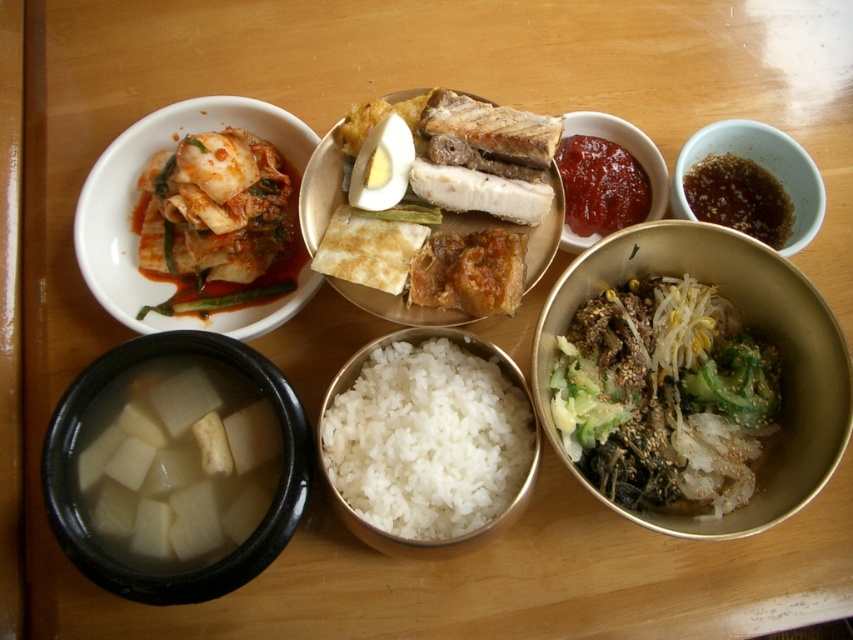
Who is positioned more to the right, white/semi-translucent/vegetable at bottom left or golden brown crispy fried pork belly at center?

golden brown crispy fried pork belly at center is more to the right.

Does white/semi-translucent/vegetable at bottom left have a greater height compared to golden brown crispy fried pork belly at center?

→ In fact, white/semi-translucent/vegetable at bottom left may be shorter than golden brown crispy fried pork belly at center.

Describe the element at coordinates (177, 461) in the screenshot. I see `white/semi-translucent/vegetable at bottom left` at that location.

Where is `white/semi-translucent/vegetable at bottom left`? white/semi-translucent/vegetable at bottom left is located at coordinates (177, 461).

Is sesame-coated mixed vegetables at center-right closer to the viewer compared to matte white kimchi at upper left?

Yes, it is in front of matte white kimchi at upper left.

Who is lower down, sesame-coated mixed vegetables at center-right or matte white kimchi at upper left?

sesame-coated mixed vegetables at center-right is lower down.

Does point (711, 376) come farther from viewer compared to point (293, 144)?

No.

The height and width of the screenshot is (640, 853). Identify the location of sesame-coated mixed vegetables at center-right. (664, 396).

Based on the photo, does white polished rice at center have a greater width compared to matte white kimchi at upper left?

No, white polished rice at center is not wider than matte white kimchi at upper left.

Based on the photo, does white polished rice at center appear on the right side of matte white kimchi at upper left?

Indeed, white polished rice at center is positioned on the right side of matte white kimchi at upper left.

Is point (497, 358) farther from camera compared to point (123, 200)?

No, (497, 358) is closer to viewer.

Identify the location of white polished rice at center. The image size is (853, 640). (428, 440).